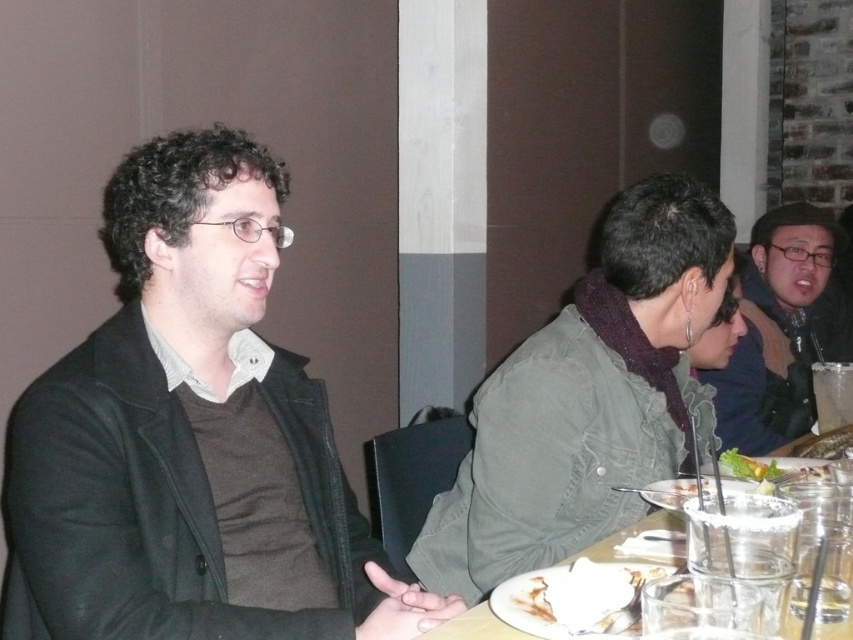
Question: Is matte black jacket at left bigger than green denim jacket at center?

Choices:
 (A) no
 (B) yes

Answer: (A)

Question: Which object appears farthest from the camera in this image?

Choices:
 (A) wooden table at center
 (B) green leafy vegetable at center
 (C) white paper plate at lower center
 (D) dark green jacket at center

Answer: (D)

Question: Is matte black jacket at left further to the viewer compared to dark green jacket at center?

Choices:
 (A) yes
 (B) no

Answer: (B)

Question: Among these points, which one is farthest from the camera?

Choices:
 (A) (474, 628)
 (B) (563, 579)
 (C) (747, 470)
 (D) (280, 628)

Answer: (C)

Question: Is green denim jacket at center positioned at the back of dark green jacket at center?

Choices:
 (A) no
 (B) yes

Answer: (A)

Question: Which point appears farthest from the camera in this image?

Choices:
 (A) (849, 349)
 (B) (612, 541)
 (C) (514, 586)

Answer: (A)